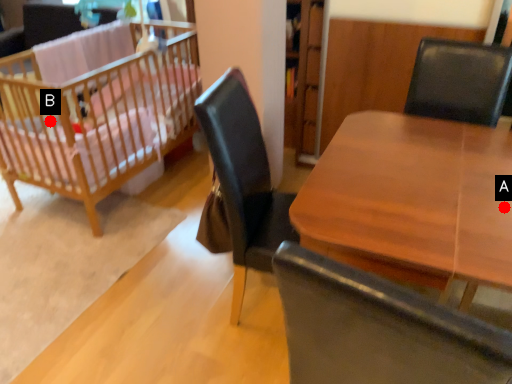
Question: Two points are circled on the image, labeled by A and B beside each circle. Which point is closer to the camera?

Choices:
 (A) A is closer
 (B) B is closer

Answer: (A)